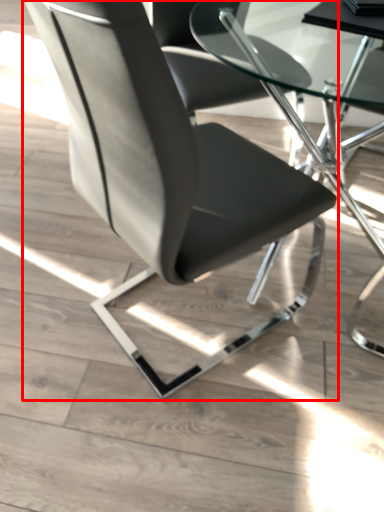
Question: From the image, what is the correct spatial relationship of chair (annotated by the red box) in relation to table?

Choices:
 (A) right
 (B) left

Answer: (B)